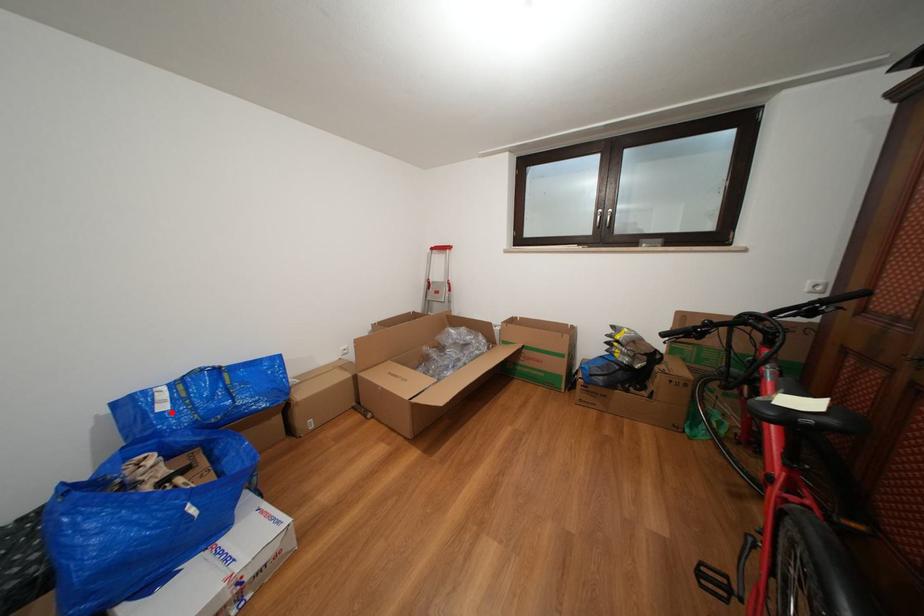
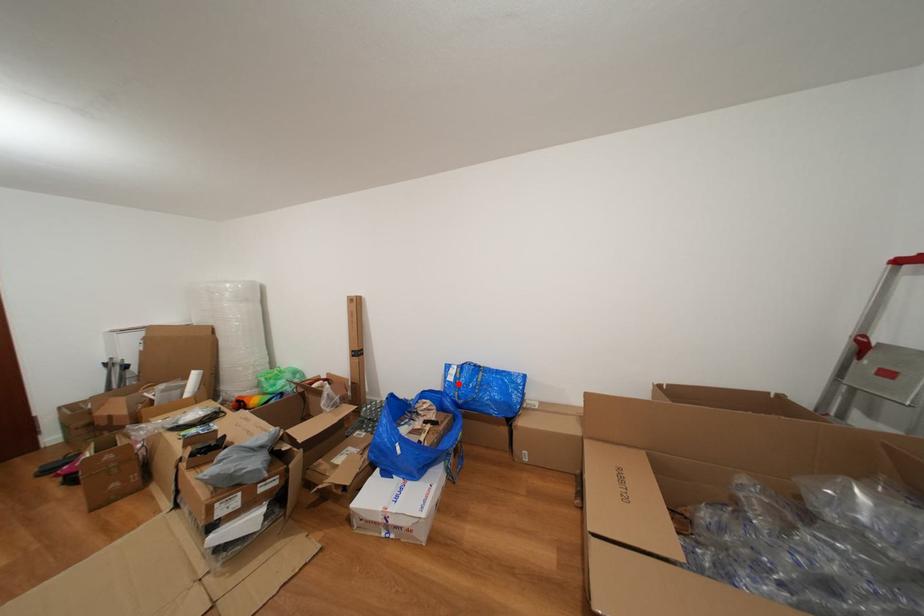
I am providing you with two images of the same scene from different viewpoints. A red point is marked on the first image and another point is marked on the second image. Does the point marked in image1 correspond to the same location as the one in image2?

Yes